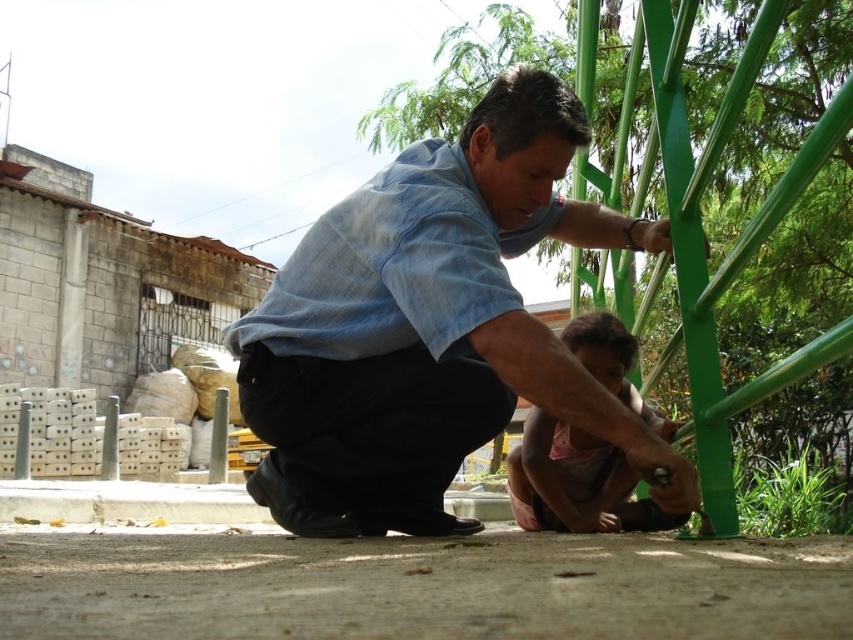
Question: Does blue denim shirt at center have a larger size compared to pink fabric shirt at lower center?

Choices:
 (A) yes
 (B) no

Answer: (A)

Question: Among these objects, which one is farthest from the camera?

Choices:
 (A) pink fabric shirt at lower center
 (B) blue denim shirt at center

Answer: (A)

Question: Which object appears closest to the camera in this image?

Choices:
 (A) blue denim shirt at center
 (B) pink fabric shirt at lower center

Answer: (A)

Question: Which point is closer to the camera taking this photo?

Choices:
 (A) (358, 246)
 (B) (509, 486)

Answer: (A)

Question: From the image, what is the correct spatial relationship of blue denim shirt at center in relation to pink fabric shirt at lower center?

Choices:
 (A) below
 (B) above

Answer: (B)

Question: Can you confirm if blue denim shirt at center is thinner than pink fabric shirt at lower center?

Choices:
 (A) yes
 (B) no

Answer: (B)